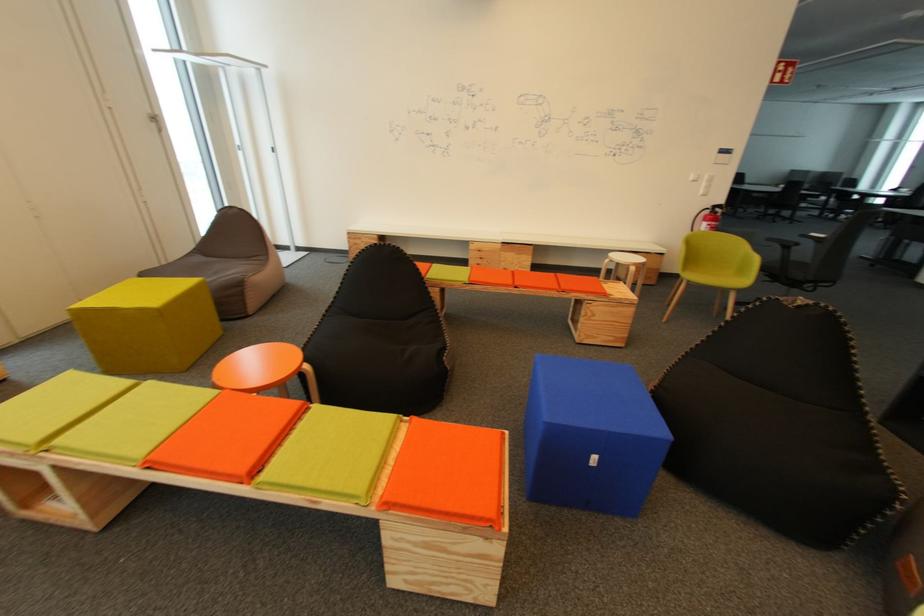
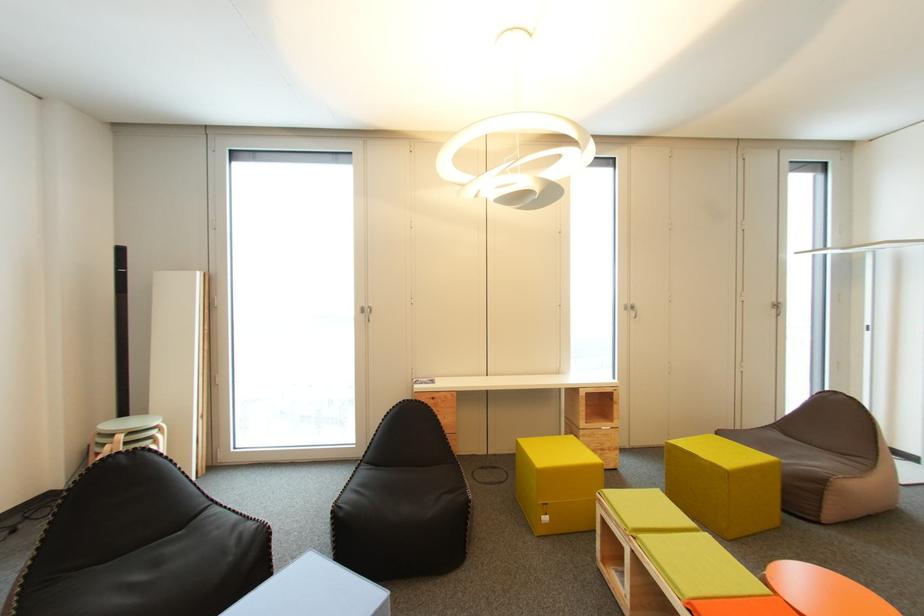
Question: The first image is from the beginning of the video and the second image is from the end. How did the camera likely rotate when shooting the video?

Choices:
 (A) Left
 (B) Right
 (C) Up
 (D) Down

Answer: (A)